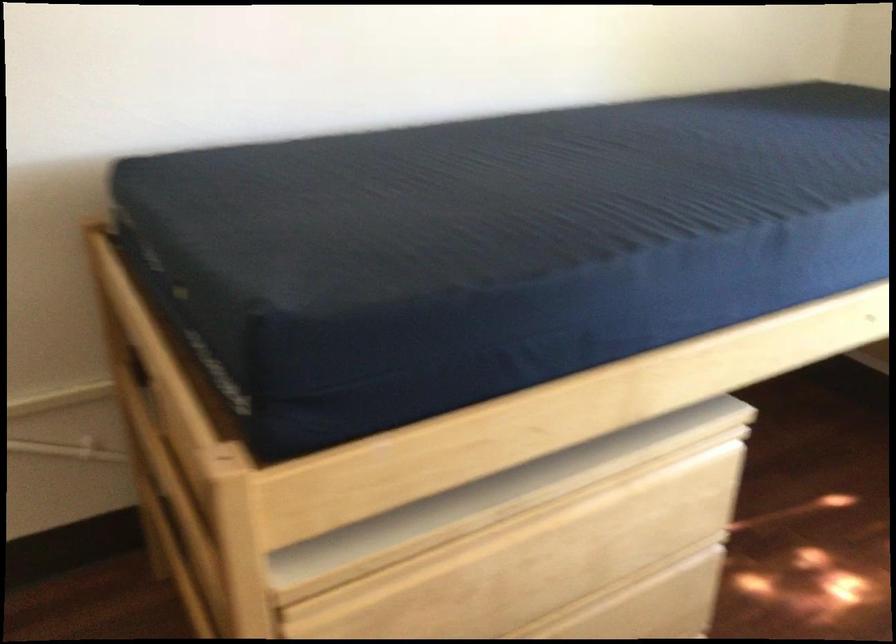
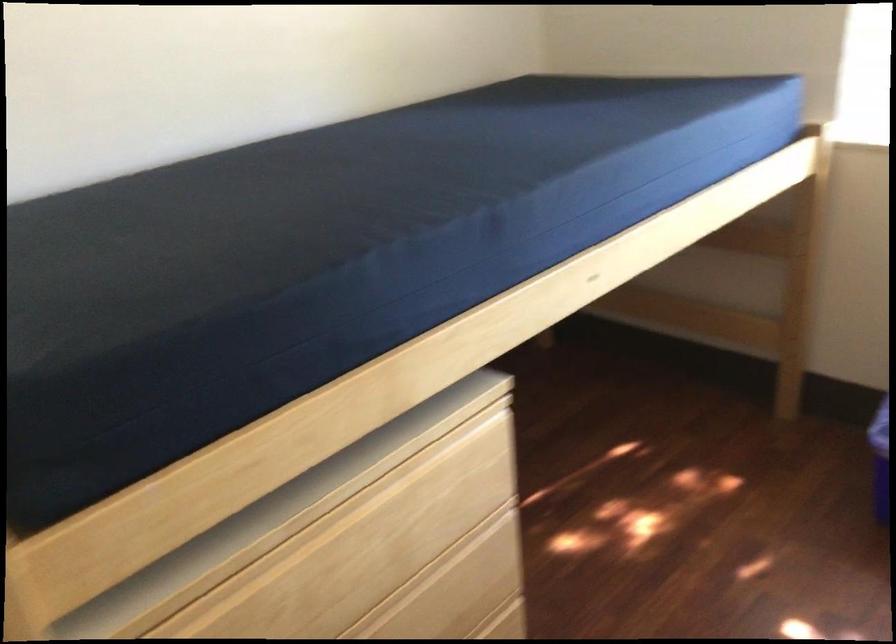
Where in the second image is the point corresponding to pixel 596 488 from the first image?

(383, 478)